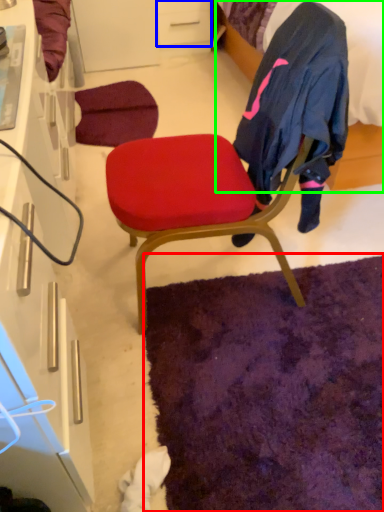
Question: Based on their relative distances, which object is farther from mat (highlighted by a red box)? Choose from drawer (highlighted by a blue box) and bed (highlighted by a green box).

Choices:
 (A) drawer
 (B) bed

Answer: (A)